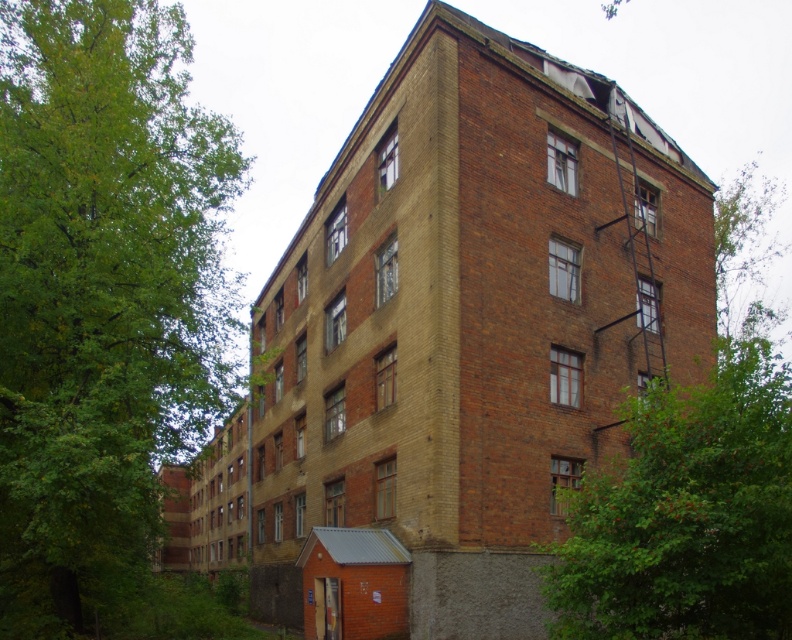
Question: Can you confirm if green leafy tree at left is smaller than green leafy tree at center?

Choices:
 (A) yes
 (B) no

Answer: (B)

Question: Is green leafy tree at left closer to the viewer compared to green leafy tree at center?

Choices:
 (A) yes
 (B) no

Answer: (B)

Question: Which point appears farthest from the camera in this image?

Choices:
 (A) (768, 573)
 (B) (124, 48)

Answer: (B)

Question: Can you confirm if green leafy tree at left is wider than green leafy tree at center?

Choices:
 (A) yes
 (B) no

Answer: (B)

Question: Which point is closer to the camera?

Choices:
 (A) green leafy tree at left
 (B) green leafy tree at center

Answer: (B)